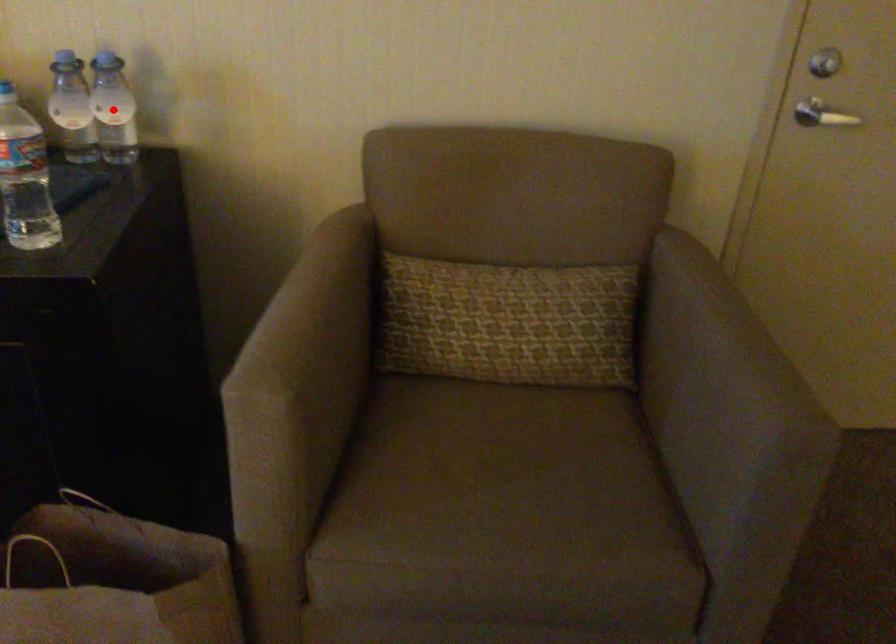
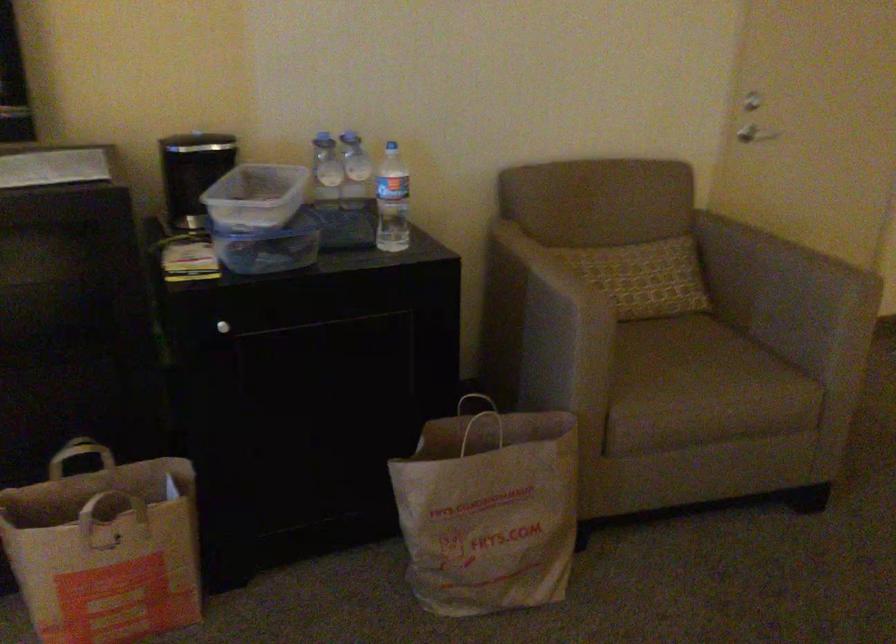
Question: I am providing you with two images of the same scene from different viewpoints. A red point is shown in image1. For the corresponding object point in image2, is it positioned nearer or farther from the camera?

Choices:
 (A) Nearer
 (B) Farther

Answer: (B)